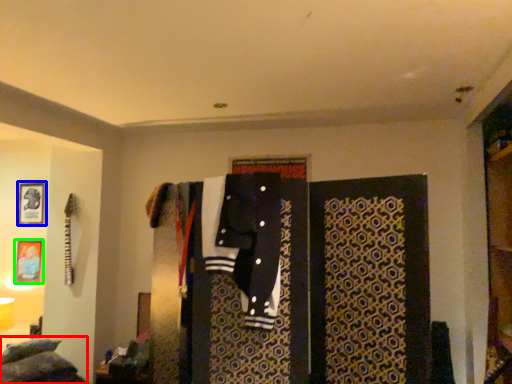
Question: Which is farther away from bed (highlighted by a red box)? picture frame (highlighted by a blue box) or picture frame (highlighted by a green box)?

Choices:
 (A) picture frame
 (B) picture frame

Answer: (A)